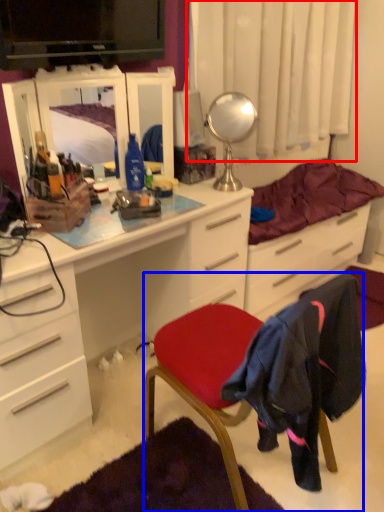
Question: Which of the following is the farthest to the observer, curtain (highlighted by a red box) or chair (highlighted by a blue box)?

Choices:
 (A) curtain
 (B) chair

Answer: (A)